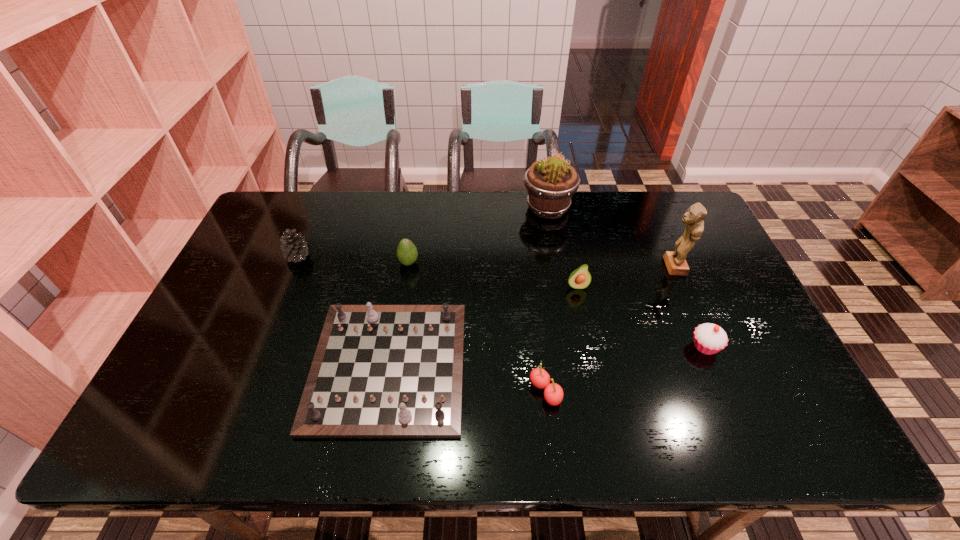
This screenshot has width=960, height=540. In order to click on object at the left edge in this screenshot , I will do `click(294, 246)`.

What are the coordinates of `figurine present at the right edge` in the screenshot? It's located at (676, 264).

Locate an element on the screen. Image resolution: width=960 pixels, height=540 pixels. cupcake that is at the right edge is located at coordinates tap(709, 338).

Find the location of a particular element. This screenshot has width=960, height=540. vacant region at the far edge of the desktop is located at coordinates (627, 217).

You are a GUI agent. You are given a task and a screenshot of the screen. Output one action in this format:
    pyautogui.click(x=<x>, y=<y>)
    Task: Click on the vacant region at the near edge of the desktop
    The height and width of the screenshot is (540, 960).
    Given the screenshot: What is the action you would take?
    pyautogui.click(x=235, y=430)

Locate an element on the screen. vacant space at the left edge is located at coordinates (257, 255).

In the image, there is a desktop. Where is `vacant space at the far right corner`? Image resolution: width=960 pixels, height=540 pixels. vacant space at the far right corner is located at coordinates (660, 208).

You are a GUI agent. You are given a task and a screenshot of the screen. Output one action in this format:
    pyautogui.click(x=<x>, y=<y>)
    Task: Click on the empty space that is in between the farthest object and the left avocado
    
    Given the screenshot: What is the action you would take?
    pyautogui.click(x=478, y=235)

The height and width of the screenshot is (540, 960). What are the coordinates of `vacant space in between the farthest object and the chessboard` in the screenshot? It's located at (468, 287).

Locate an element on the screen. free space that is in between the left avocado and the right avocado is located at coordinates (492, 274).